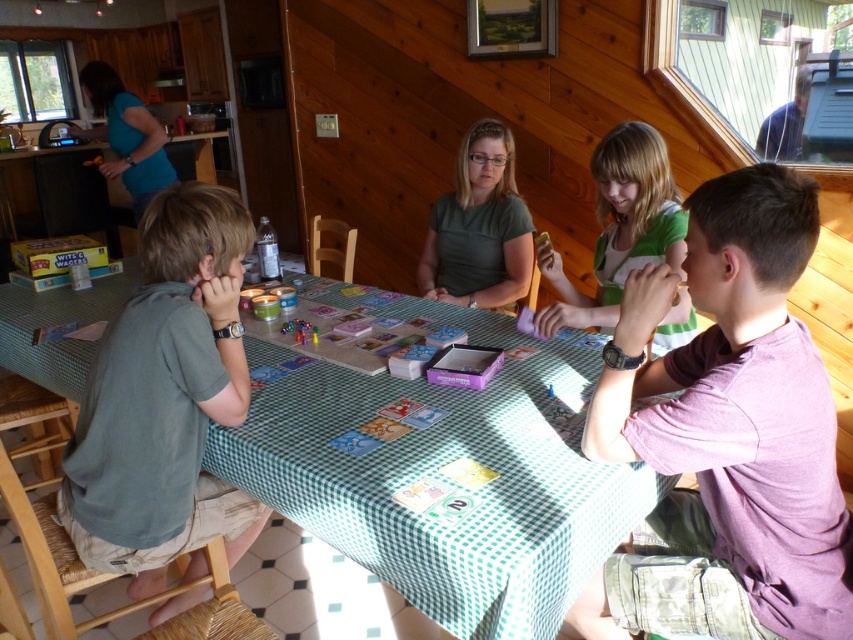
You are a guest at the cabin and want to place a small gift on the table near the green checkered tablecloth at center without it being too close to the green matte shirt at center. Based on their positions, where should you place the gift?

The green checkered tablecloth at center is on the left side of the green matte shirt at center, so placing the gift to the left of the green checkered tablecloth at center would keep it away from the green matte shirt at center.

You are standing in front of the dining table and want to place a small vase between the two points, point (772, 353) and point (497, 170). Which point should the vase be closer to in order to be in the foreground?

The vase should be closer to point (772, 353) because it is closer to the camera than point (497, 170), so placing it near that point will keep it in the foreground.

You are a guest at this cozy cabin and want to place a small vase between the green checkered tablecloth at center and the green matte shirt at center. The vase is 10 centimeters wide. Is there enough space between them to fit the vase?

The distance between the green checkered tablecloth at center and the green matte shirt at center is 55.48 centimeters, which is more than enough to accommodate a 10 centimeter wide vase.